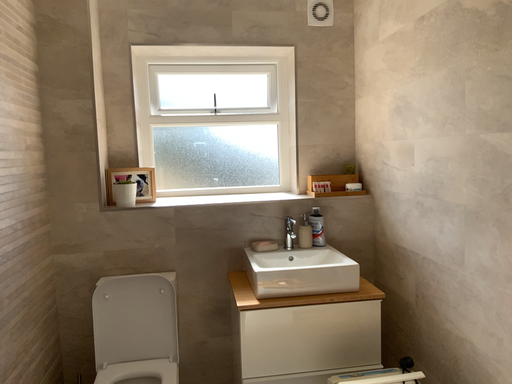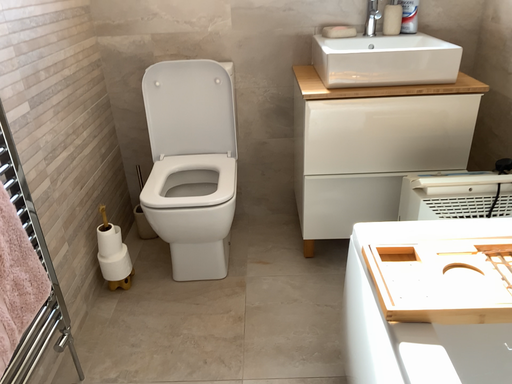
Question: How did the camera likely rotate when shooting the video?

Choices:
 (A) rotated downward
 (B) rotated upward

Answer: (A)